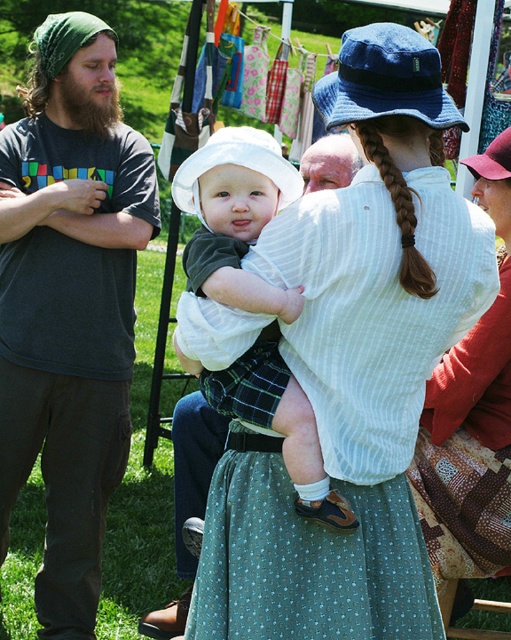
Who is higher up, dark gray t-shirt at left or green plaid shorts at center?

green plaid shorts at center

The width and height of the screenshot is (511, 640). What are the coordinates of `dark gray t-shirt at left` in the screenshot? It's located at (69, 305).

Which of these two, dark gray t-shirt at left or white striped shirt at center, stands shorter?

With less height is white striped shirt at center.

Is dark gray t-shirt at left in front of white striped shirt at center?

No, dark gray t-shirt at left is further to the viewer.

Does point (90, 228) come in front of point (429, 438)?

No, it is not.

Identify the location of dark gray t-shirt at left. The height and width of the screenshot is (640, 511). (69, 305).

From the picture: Is green dotted fabric dress at center shorter than white striped shirt at center?

Yes, green dotted fabric dress at center is shorter than white striped shirt at center.

Who is more distant from viewer, [235,538] or [506,136]?

Point [506,136]

The width and height of the screenshot is (511, 640). Find the location of `green dotted fabric dress at center`. green dotted fabric dress at center is located at coordinates (345, 419).